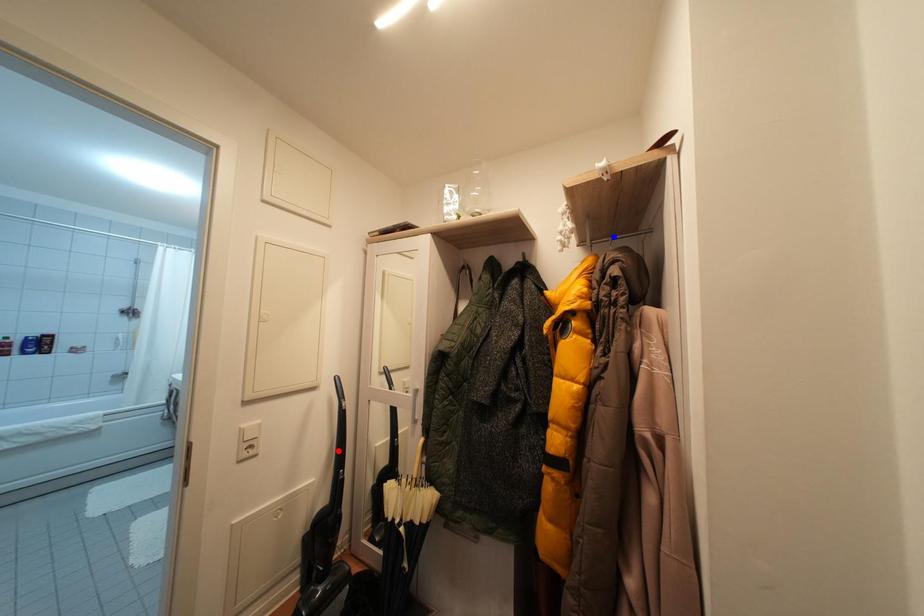
Question: Two points are marked on the image. Which point is closer to the camera?

Choices:
 (A) Blue point is closer.
 (B) Red point is closer.

Answer: (A)